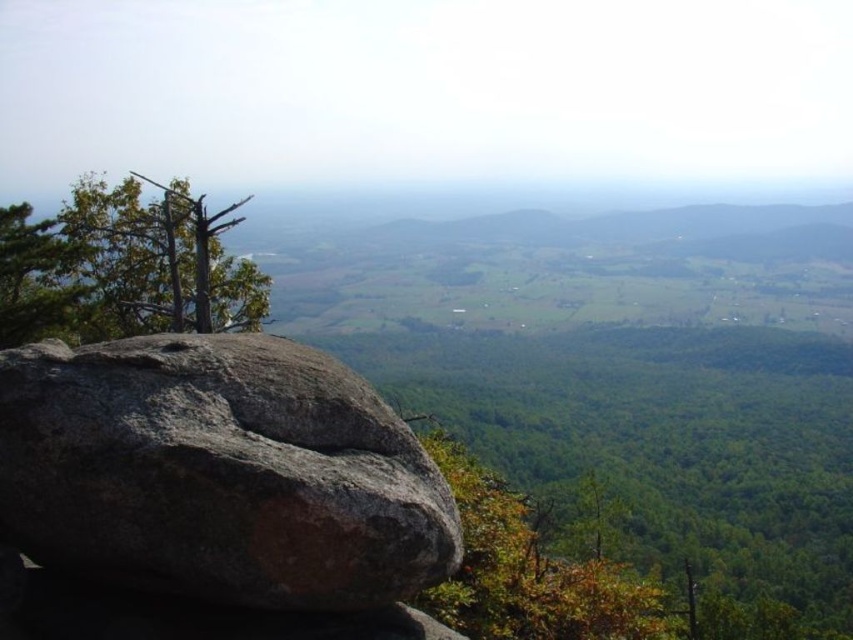
You are an explorer standing at the base of the gray rough rock at center and want to reach the green leafy tree at upper left. Which direction should you walk to get closer to the tree?

You should walk to the left because the green leafy tree at upper left is located to the left side of the gray rough rock at center.

Based on the provided image, what are the coordinates of the gray rough rock at center?

The gray rough rock at center is located at coordinates (218, 472).